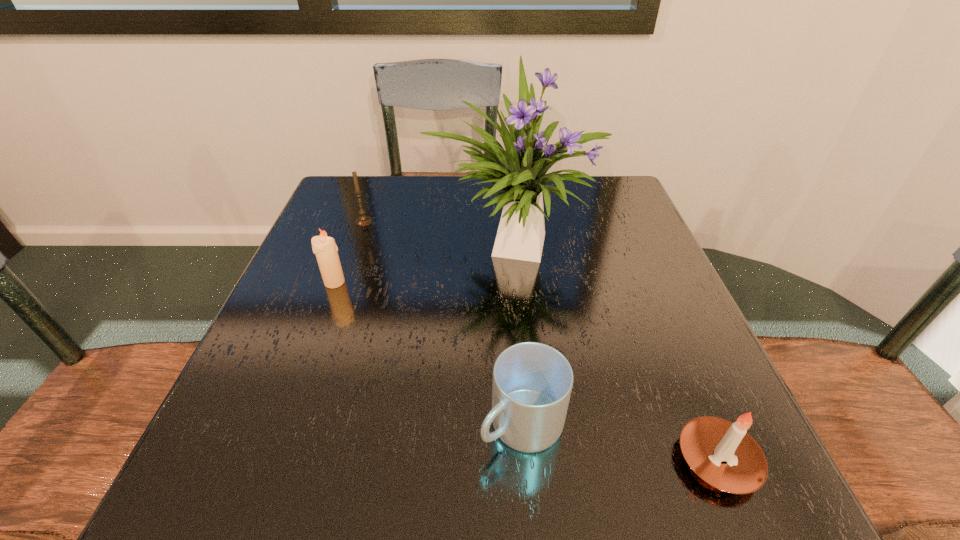
Locate an element on the screen. Image resolution: width=960 pixels, height=540 pixels. free space located on the left of the rightmost object is located at coordinates (542, 460).

What are the coordinates of `flower arrangement at the far edge` in the screenshot? It's located at (520, 172).

Where is `candle that is at the far edge`? candle that is at the far edge is located at coordinates (364, 220).

The image size is (960, 540). Identify the location of mug positioned at the near edge. (532, 382).

Where is `candle situated at the near edge`? candle situated at the near edge is located at coordinates (722, 453).

Where is `flower arrangement located in the right edge section of the desktop`? flower arrangement located in the right edge section of the desktop is located at coordinates (520, 172).

Where is `candle present at the right edge`? This screenshot has height=540, width=960. candle present at the right edge is located at coordinates (722, 453).

You are a GUI agent. You are given a task and a screenshot of the screen. Output one action in this format:
    pyautogui.click(x=<x>, y=<y>)
    Task: Click on the object located in the far left corner section of the desktop
    This screenshot has width=960, height=540.
    Given the screenshot: What is the action you would take?
    pyautogui.click(x=364, y=220)

Locate an element on the screen. Image resolution: width=960 pixels, height=540 pixels. object that is at the far right corner is located at coordinates (520, 172).

I want to click on object that is at the near right corner, so click(722, 453).